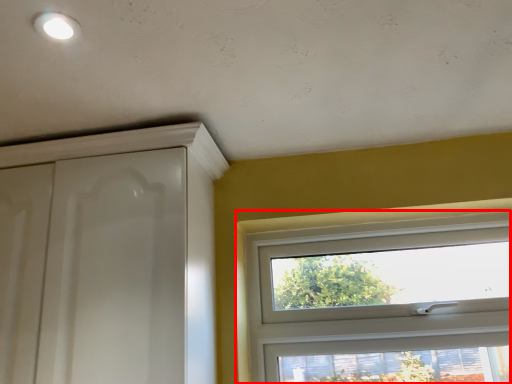
Question: Observing the image, what is the correct spatial positioning of window (annotated by the red box) in reference to screen door?

Choices:
 (A) left
 (B) right

Answer: (B)